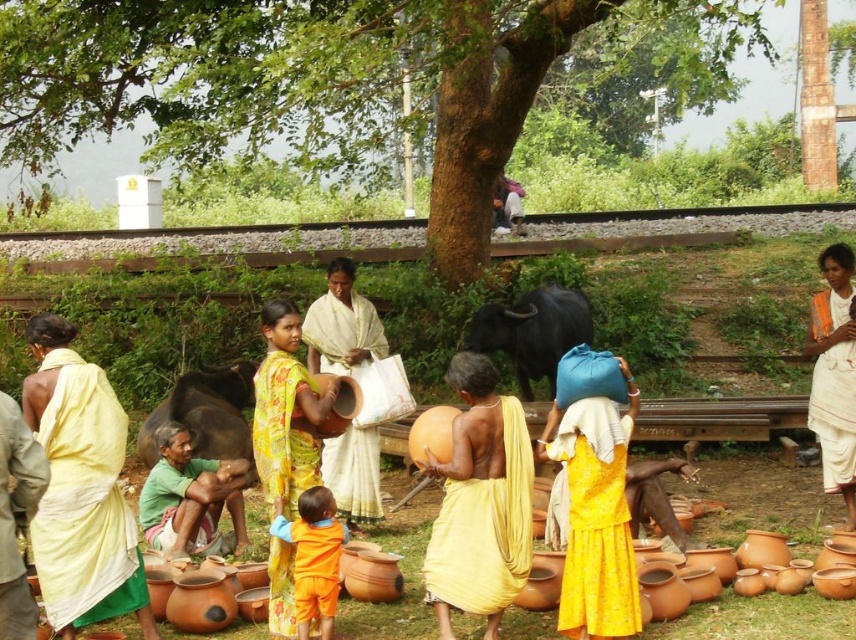
Question: Does green leafy tree at center appear under orange cotton shirt at center?

Choices:
 (A) yes
 (B) no

Answer: (B)

Question: Which point is closer to the camera?

Choices:
 (A) yellow printed saree at center
 (B) yellow fabric at left
 (C) matte yellow fabric at center

Answer: (B)

Question: Is white silk saree at center below green cotton shirt at lower left?

Choices:
 (A) no
 (B) yes

Answer: (A)

Question: Can you confirm if yellow fabric at left is positioned to the left of white cotton saree at center?

Choices:
 (A) no
 (B) yes

Answer: (B)

Question: Which object appears farthest from the camera in this image?

Choices:
 (A) yellow brocade dress at center
 (B) green cotton shirt at lower left
 (C) orange cotton shirt at center

Answer: (B)

Question: Which point is closer to the camera taking this photo?

Choices:
 (A) (614, 456)
 (B) (277, 515)
 (C) (310, 122)

Answer: (A)